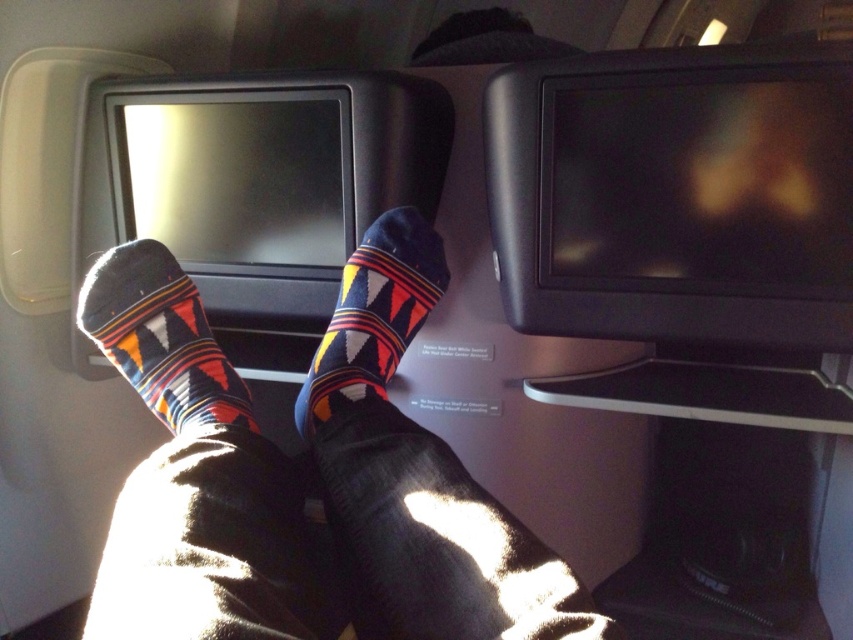
Question: Which object is the farthest from the knit socks at center?

Choices:
 (A) patterned fabric socks at center
 (B) dark blue cotton socks at center

Answer: (A)

Question: Estimate the real-world distances between objects in this image. Which object is closer to the patterned fabric socks at center?

Choices:
 (A) knit socks at center
 (B) dark blue cotton socks at center

Answer: (A)

Question: Estimate the real-world distances between objects in this image. Which object is closer to the dark blue cotton socks at center?

Choices:
 (A) patterned fabric socks at center
 (B) knit socks at center

Answer: (B)

Question: Can you confirm if knit socks at center is positioned above dark blue cotton socks at center?

Choices:
 (A) no
 (B) yes

Answer: (A)

Question: Is patterned fabric socks at center wider than dark blue cotton socks at center?

Choices:
 (A) no
 (B) yes

Answer: (B)

Question: Does knit socks at center appear on the right side of dark blue cotton socks at center?

Choices:
 (A) no
 (B) yes

Answer: (A)